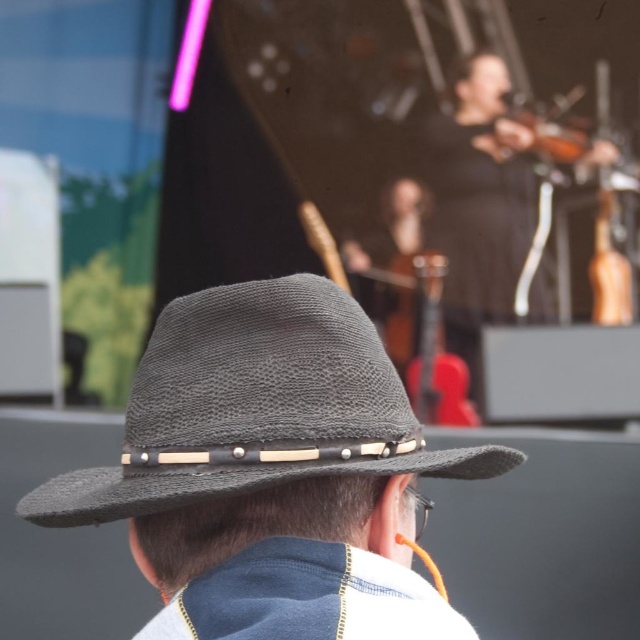
Who is taller, black woven hat at center or faded denim jacket at lower right?

With more height is black woven hat at center.

Does black woven hat at center have a lesser height compared to faded denim jacket at lower right?

In fact, black woven hat at center may be taller than faded denim jacket at lower right.

Who is more distant from viewer, [144,364] or [236,586]?

The point [144,364] is behind.

Locate an element on the screen. This screenshot has width=640, height=640. black woven hat at center is located at coordinates (257, 406).